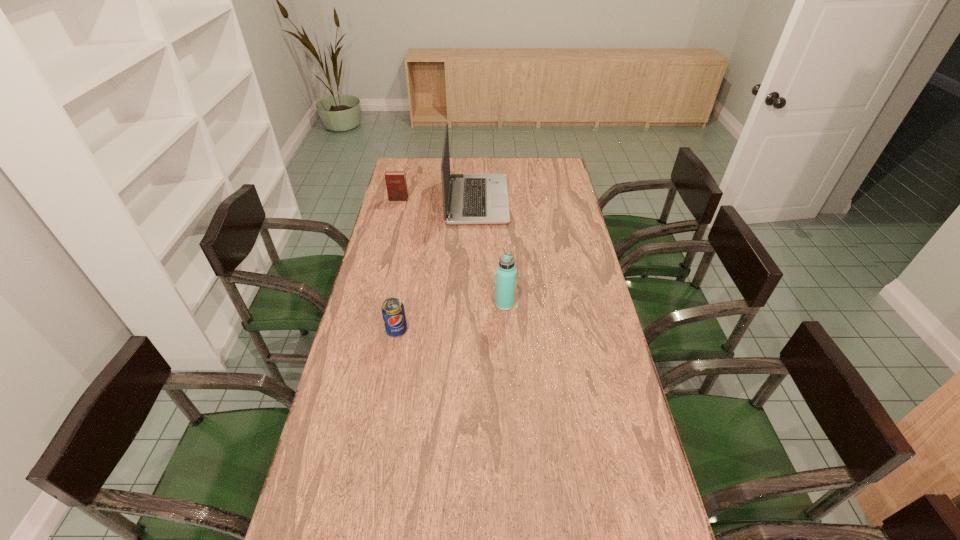
Identify the location of object located in the far edge section of the desktop. The height and width of the screenshot is (540, 960). (473, 198).

You are a GUI agent. You are given a task and a screenshot of the screen. Output one action in this format:
    pyautogui.click(x=<x>, y=<y>)
    Task: Click on the diary at the left edge
    Image resolution: width=960 pixels, height=540 pixels.
    Given the screenshot: What is the action you would take?
    pyautogui.click(x=396, y=185)

The image size is (960, 540). Identify the location of soda located in the left edge section of the desktop. (393, 312).

What are the coordinates of `vacant space at the far edge of the desktop` in the screenshot? It's located at (532, 176).

Identify the location of vacant space at the left edge of the desktop. Image resolution: width=960 pixels, height=540 pixels. (331, 446).

Locate an element on the screen. The width and height of the screenshot is (960, 540). vacant region at the right edge is located at coordinates (633, 458).

In the image, there is a desktop. What are the coordinates of `vacant space at the far right corner` in the screenshot? It's located at (554, 179).

Image resolution: width=960 pixels, height=540 pixels. I want to click on unoccupied position between the diary and the soda, so click(397, 265).

In order to click on vacant space that's between the leftmost object and the nearest object in this screenshot , I will do `click(397, 265)`.

Locate an element on the screen. The width and height of the screenshot is (960, 540). free space between the leftmost object and the soda is located at coordinates (397, 265).